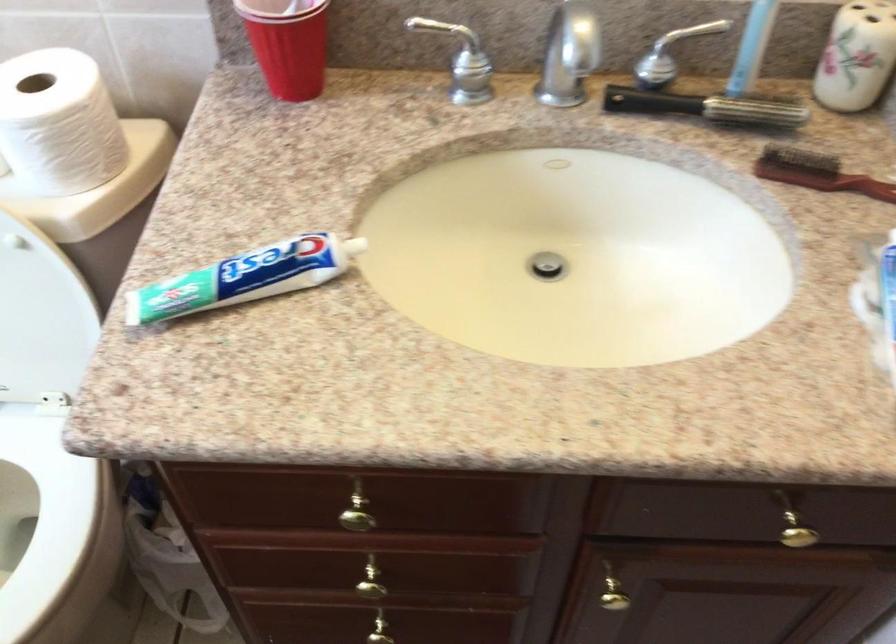
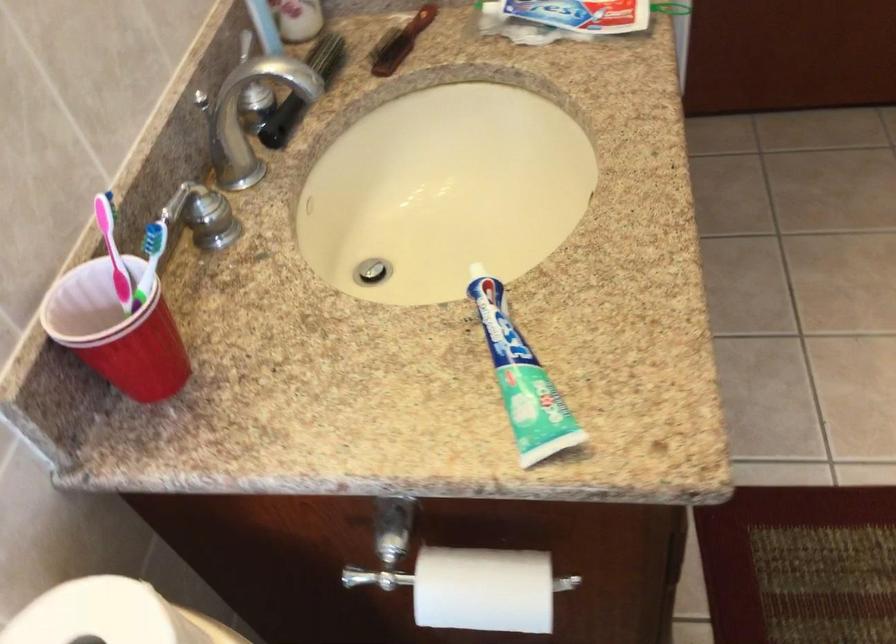
The point at (816, 176) is marked in the first image. Where is the corresponding point in the second image?

(400, 42)